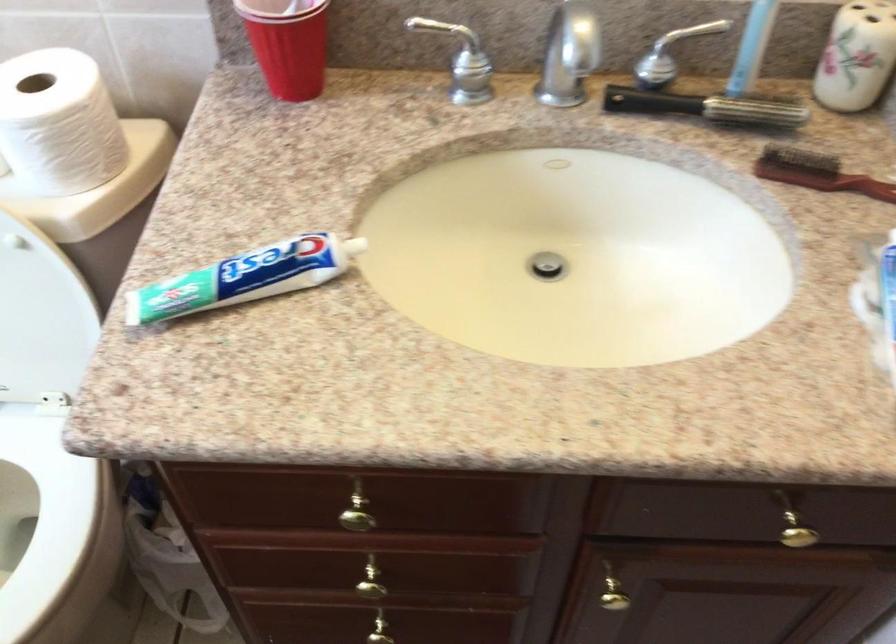
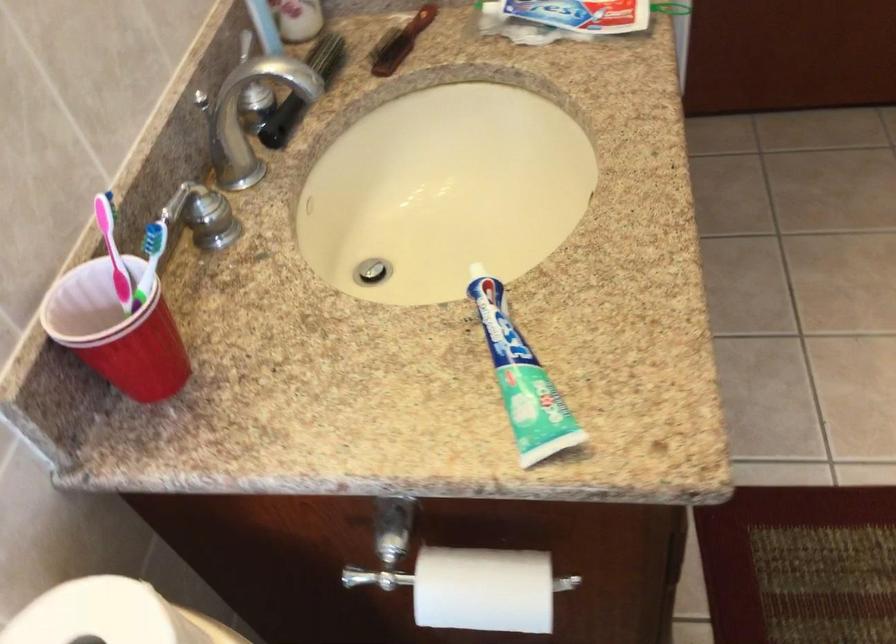
The point at (816, 176) is marked in the first image. Where is the corresponding point in the second image?

(400, 42)